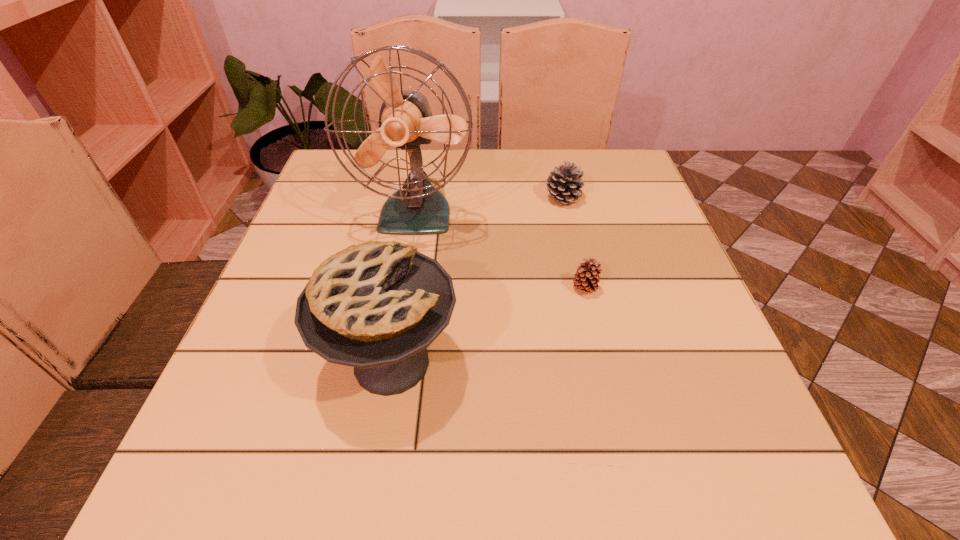
Where is `blank space located 0.170m on the front of the shorter pinecone`? The width and height of the screenshot is (960, 540). blank space located 0.170m on the front of the shorter pinecone is located at coordinates (603, 372).

Identify the location of fan that is at the far edge. The height and width of the screenshot is (540, 960). (405, 121).

At what (x,y) coordinates should I click in order to perform the action: click on pinecone at the far edge. Please return your answer as a coordinate pair (x, y). Looking at the image, I should click on (564, 182).

At what (x,y) coordinates should I click in order to perform the action: click on fan that is positioned at the left edge. Please return your answer as a coordinate pair (x, y). The height and width of the screenshot is (540, 960). Looking at the image, I should click on (405, 121).

In order to click on pie situated at the left edge in this screenshot , I will do `click(377, 306)`.

At what (x,y) coordinates should I click in order to perform the action: click on object present at the far left corner. Please return your answer as a coordinate pair (x, y). This screenshot has height=540, width=960. Looking at the image, I should click on (405, 121).

Locate an element on the screen. Image resolution: width=960 pixels, height=540 pixels. blank space at the far edge of the desktop is located at coordinates (504, 160).

Where is `free region at the near edge of the desktop`? free region at the near edge of the desktop is located at coordinates click(x=590, y=446).

Find the location of a particular element. vacant space at the left edge is located at coordinates [279, 307].

In the image, there is a desktop. Where is `vacant region at the right edge`? This screenshot has height=540, width=960. vacant region at the right edge is located at coordinates (615, 289).